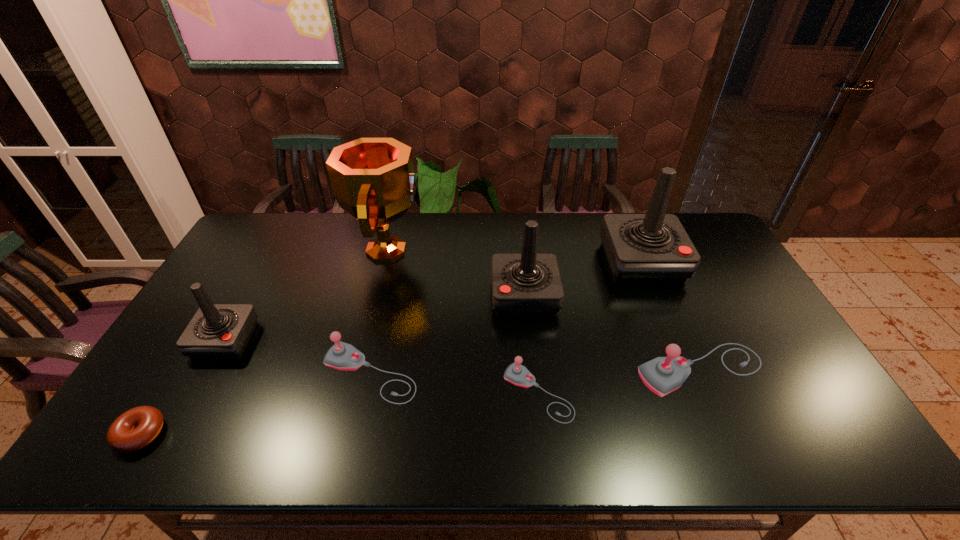
This screenshot has height=540, width=960. In order to click on doughnut situated at the left edge in this screenshot , I will do `click(134, 429)`.

Locate an element on the screen. The image size is (960, 540). object present at the right edge is located at coordinates (662, 375).

The image size is (960, 540). What are the coordinates of `object present at the near left corner` in the screenshot? It's located at (134, 429).

In the image, there is a desktop. Find the location of `vacant space at the far edge`. vacant space at the far edge is located at coordinates (331, 249).

This screenshot has width=960, height=540. Find the location of `vacant space at the near edge of the desktop`. vacant space at the near edge of the desktop is located at coordinates (312, 449).

Find the location of a particular element. Image resolution: width=960 pixels, height=540 pixels. free spot at the far left corner of the desktop is located at coordinates (256, 233).

Locate an element on the screen. free space at the near right corner of the desktop is located at coordinates (829, 448).

Locate an element on the screen. The image size is (960, 540). blank region between the fifth shortest joystick and the rightmost gray joystick is located at coordinates (612, 333).

Locate an element on the screen. empty space between the second biggest gray joystick and the fourth shortest joystick is located at coordinates (298, 357).

This screenshot has height=540, width=960. What are the coordinates of `free point between the fifth tallest joystick and the third shortest joystick` in the screenshot? It's located at (536, 372).